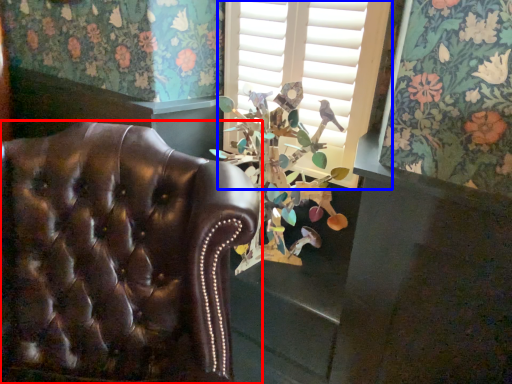
Question: Among these objects, which one is farthest to the camera, chair (highlighted by a red box) or window (highlighted by a blue box)?

Choices:
 (A) chair
 (B) window

Answer: (B)